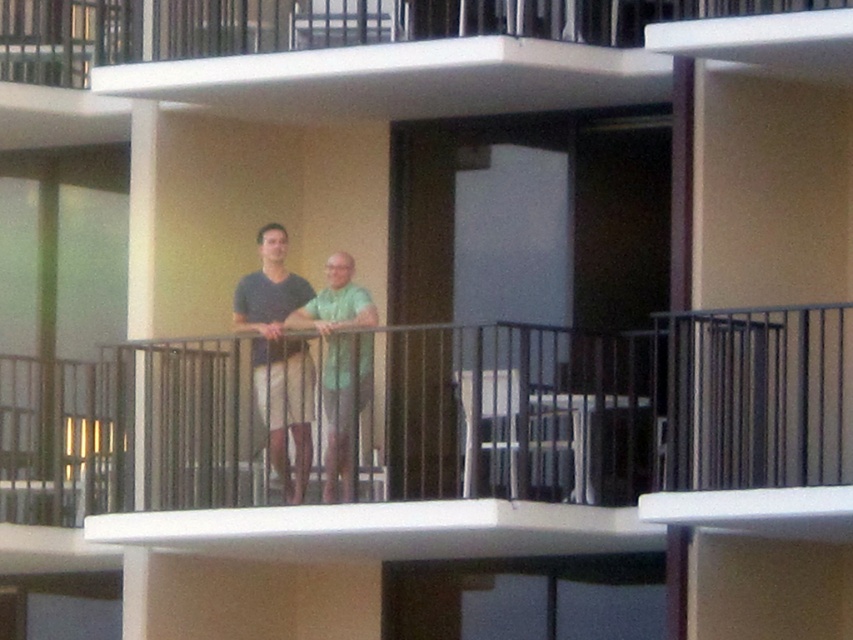
You are standing on the balcony and want to place a small potted plant exactly at the point marked by the coordinates point (316, 26). Based on the scene description, where would this point be located?

The point (316, 26) marks the white concrete balcony at upper center, so placing the potted plant there would position it on the upper central part of the balcony.

You are a drone operator tasked with delivering a package to the white concrete balcony at upper center. Your drone can only fly up to 12 meters. Can the drone reach the matte green shirt at center from its current position?

The distance between the white concrete balcony at upper center and the matte green shirt at center is 13.28 meters, which exceeds the drone maximum flight distance of 12 meters. Therefore, the drone cannot reach the matte green shirt at center.

You are standing on the ground floor looking up at the building. Which object is closer to you between the white concrete balcony at upper center and the matte green shirt at center?

The white concrete balcony at upper center is closer to the viewer than the matte green shirt at center.